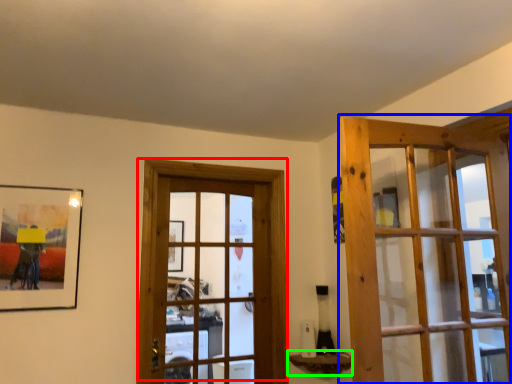
Question: Which object is the closest to the door (highlighted by a red box)? Choose among these: door (highlighted by a blue box) or window sill (highlighted by a green box).

Choices:
 (A) door
 (B) window sill

Answer: (B)